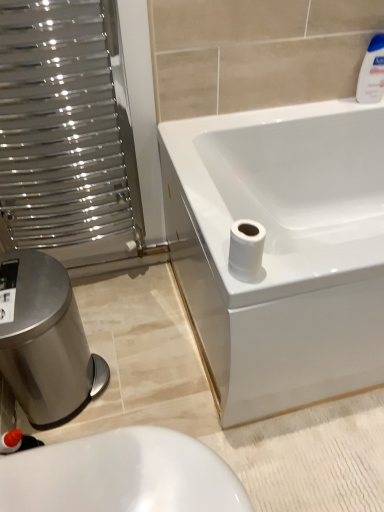
Question: Considering the positions of white glossy bathtub at upper right and white glossy toilet at lower left in the image, is white glossy bathtub at upper right bigger or smaller than white glossy toilet at lower left?

Choices:
 (A) small
 (B) big

Answer: (B)

Question: Is white glossy bathtub at upper right in front of or behind white glossy toilet at lower left in the image?

Choices:
 (A) front
 (B) behind

Answer: (B)

Question: Which object is positioned farthest from the white glossy bathtub at upper right?

Choices:
 (A) white glossy bottle at upper right
 (B) brushed metal bidet at lower left
 (C) white matte toilet paper at lower right
 (D) white glossy toilet at lower left
 (E) metallic silver radiator at left

Answer: (D)

Question: Considering the real-world distances, which object is closest to the brushed metal bidet at lower left?

Choices:
 (A) white glossy bathtub at upper right
 (B) white matte toilet paper at lower right
 (C) metallic silver radiator at left
 (D) white glossy bottle at upper right
 (E) white glossy toilet at lower left

Answer: (C)